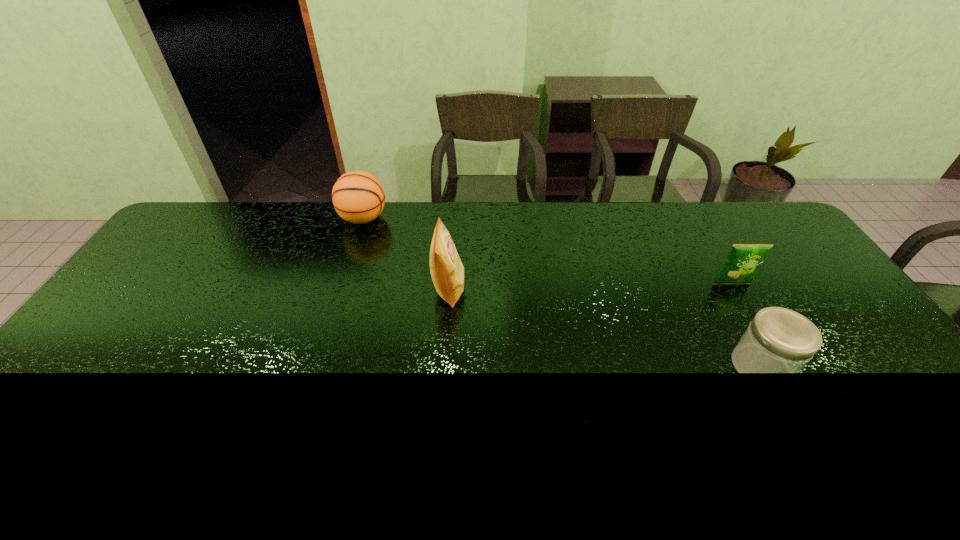
Image resolution: width=960 pixels, height=540 pixels. Find the location of `free space between the nearest object and the second object from left to right`. free space between the nearest object and the second object from left to right is located at coordinates (605, 328).

Image resolution: width=960 pixels, height=540 pixels. Find the location of `empty space that is in between the nearest object and the basketball`. empty space that is in between the nearest object and the basketball is located at coordinates (563, 293).

Where is `empty location between the shorter crisp (potato chip) and the tallest object`? The image size is (960, 540). empty location between the shorter crisp (potato chip) and the tallest object is located at coordinates (590, 287).

Locate an element on the screen. This screenshot has width=960, height=540. object that is the second closest to the leftmost object is located at coordinates (744, 260).

Identify which object is located as the second nearest to the tallest object. Please provide its 2D coordinates. Your answer should be formatted as a tuple, i.e. [(x, y)], where the tuple contains the x and y coordinates of a point satisfying the conditions above.

[(778, 340)]

Locate an element on the screen. The image size is (960, 540). vacant area in the image that satisfies the following two spatial constraints: 1. on the front-facing side of the shorter crisp (potato chip); 2. on the front-facing side of the left crisp (potato chip) is located at coordinates (734, 289).